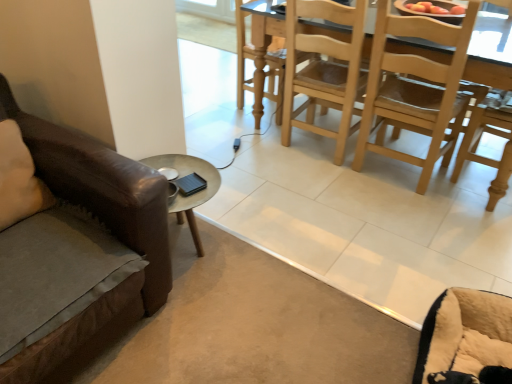
Question: Is beige fabric pillow at left oriented away from light brown wood chair at center?

Choices:
 (A) yes
 (B) no

Answer: (B)

Question: Is beige fabric pillow at left positioned beyond the bounds of light brown wood chair at center?

Choices:
 (A) no
 (B) yes

Answer: (B)

Question: Could light brown wood chair at center be considered to be inside beige fabric pillow at left?

Choices:
 (A) yes
 (B) no

Answer: (B)

Question: Does beige fabric pillow at left turn towards light brown wood chair at center?

Choices:
 (A) no
 (B) yes

Answer: (A)

Question: Is beige fabric pillow at left at the right side of light brown wood chair at center?

Choices:
 (A) yes
 (B) no

Answer: (B)

Question: Considering the positions of point (5, 180) and point (336, 54), is point (5, 180) closer or farther from the camera than point (336, 54)?

Choices:
 (A) closer
 (B) farther

Answer: (A)

Question: In the image, is beige fabric pillow at left on the left side or the right side of light brown wood chair at center?

Choices:
 (A) left
 (B) right

Answer: (A)

Question: From a real-world perspective, relative to light brown wood chair at center, is beige fabric pillow at left vertically above or below?

Choices:
 (A) above
 (B) below

Answer: (A)

Question: Is beige fabric pillow at left in front of or behind light brown wood chair at center in the image?

Choices:
 (A) front
 (B) behind

Answer: (A)

Question: Considering the positions of light brown wood chair at center and beige plush swivel chair at lower right in the image, is light brown wood chair at center taller or shorter than beige plush swivel chair at lower right?

Choices:
 (A) short
 (B) tall

Answer: (B)

Question: Is light brown wood chair at center in front of or behind beige plush swivel chair at lower right in the image?

Choices:
 (A) behind
 (B) front

Answer: (A)

Question: Which is correct: light brown wood chair at center is inside beige plush swivel chair at lower right, or outside of it?

Choices:
 (A) outside
 (B) inside

Answer: (A)

Question: Does point (335, 99) appear closer or farther from the camera than point (477, 306)?

Choices:
 (A) closer
 (B) farther

Answer: (B)

Question: From the image's perspective, is beige plush swivel chair at lower right located above or below light brown wood chair at center?

Choices:
 (A) below
 (B) above

Answer: (A)

Question: Is point (489, 327) closer or farther from the camera than point (352, 109)?

Choices:
 (A) farther
 (B) closer

Answer: (B)